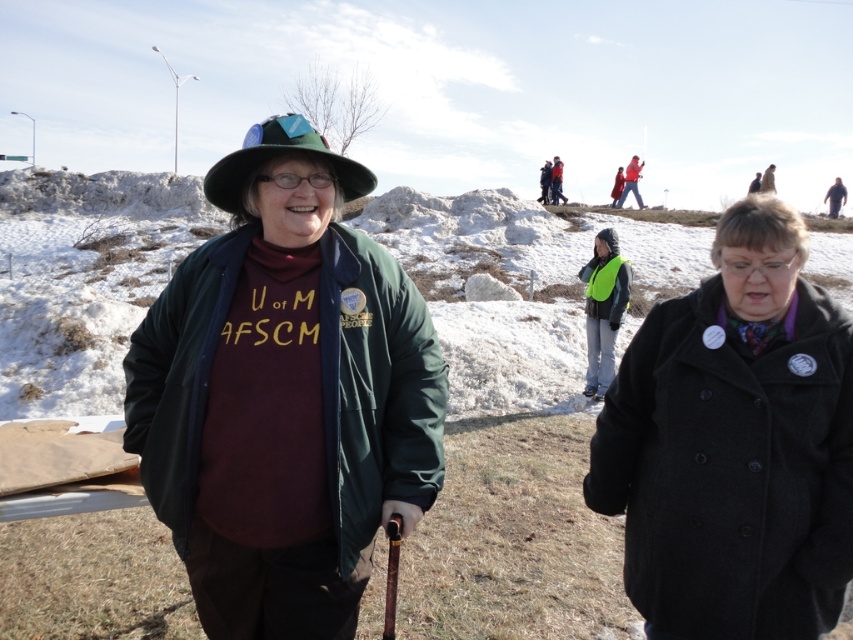
Question: Observing the image, what is the correct spatial positioning of green matte jacket at center in reference to red wool sweater at upper center?

Choices:
 (A) above
 (B) below

Answer: (B)

Question: Which of the following is the closest to the observer?

Choices:
 (A) click(x=294, y=301)
 (B) click(x=544, y=179)
 (C) click(x=236, y=193)
 (D) click(x=97, y=253)

Answer: (A)

Question: Estimate the real-world distances between objects in this image. Which object is closer to the black wool coat at center?

Choices:
 (A) red wool sweater at upper center
 (B) green felt hat at center

Answer: (B)

Question: Where is black wool coat at center located in relation to red wool sweater at upper center in the image?

Choices:
 (A) left
 (B) right

Answer: (A)

Question: Which point is closer to the camera?

Choices:
 (A) (270, 300)
 (B) (770, 632)

Answer: (B)

Question: Can you confirm if green matte jacket at center is positioned above green felt hat at center?

Choices:
 (A) yes
 (B) no

Answer: (B)